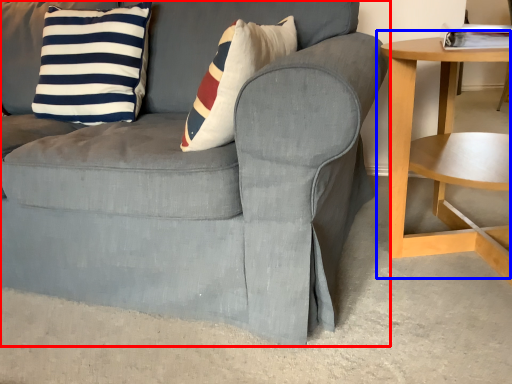
Question: Among these objects, which one is nearest to the camera, chair (highlighted by a red box) or table (highlighted by a blue box)?

Choices:
 (A) chair
 (B) table

Answer: (A)